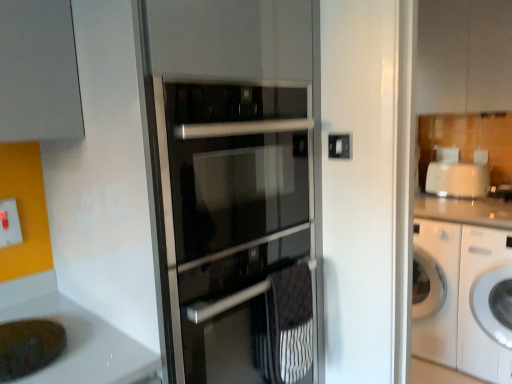
This screenshot has height=384, width=512. Describe the element at coordinates (9, 223) in the screenshot. I see `white plastic electric outlet at lower left` at that location.

What do you see at coordinates (485, 304) in the screenshot?
I see `white glossy washing machine at right` at bounding box center [485, 304].

What do you see at coordinates (464, 56) in the screenshot? This screenshot has height=384, width=512. I see `white glossy cabinet at upper center` at bounding box center [464, 56].

Locate an element on the screen. The width and height of the screenshot is (512, 384). matte white sink at lower left is located at coordinates pos(30,346).

Is white glossy cabinet at upper center oriented away from white plastic electric outlet at lower left?

No, white glossy cabinet at upper center's orientation is not away from white plastic electric outlet at lower left.

Can you confirm if white glossy cabinet at upper center is wider than white plastic electric outlet at lower left?

Yes.

Is white glossy cabinet at upper center far away from white plastic electric outlet at lower left?

Yes, white glossy cabinet at upper center and white plastic electric outlet at lower left are located far from each other.

Does black textured towel at center have a lesser width compared to white plastic electric outlet at lower left?

No.

In the scene shown: How much distance is there between black textured towel at center and white plastic electric outlet at lower left?

black textured towel at center is 36.09 inches from white plastic electric outlet at lower left.

Does black textured towel at center turn towards white plastic electric outlet at lower left?

No.

Is black textured towel at center positioned behind white plastic electric outlet at lower left?

No, black textured towel at center is closer to the viewer.

Which object is positioned more to the right, black textured towel at center or white glossy washing machine at right?

white glossy washing machine at right.

Is black textured towel at center positioned with its back to white glossy washing machine at right?

black textured towel at center is not turned away from white glossy washing machine at right.

Between black textured towel at center and white glossy washing machine at right, which one has smaller size?

Smaller between the two is black textured towel at center.

Measure the distance from black textured towel at center to white glossy washing machine at right.

A distance of 4.38 feet exists between black textured towel at center and white glossy washing machine at right.

From the image's perspective, which object appears higher, black textured towel at center or white glossy cabinet at upper center?

white glossy cabinet at upper center.

Is black textured towel at center closer to the viewer compared to white glossy cabinet at upper center?

Yes, the depth of black textured towel at center is less than that of white glossy cabinet at upper center.

From the picture: Would you say black textured towel at center is outside white glossy cabinet at upper center?

black textured towel at center is positioned outside white glossy cabinet at upper center.

From the picture: Considering the relative sizes of black textured towel at center and white glossy cabinet at upper center in the image provided, is black textured towel at center smaller than white glossy cabinet at upper center?

Yes.

Which object is positioned more to the right, white plastic electric outlet at lower left or white glossy washing machine at right?

From the viewer's perspective, white glossy washing machine at right appears more on the right side.

From the image's perspective, relative to white glossy washing machine at right, is white plastic electric outlet at lower left above or below?

From the image's perspective, white plastic electric outlet at lower left appears above white glossy washing machine at right.

Looking at their sizes, would you say white plastic electric outlet at lower left is wider or thinner than white glossy washing machine at right?

In the image, white plastic electric outlet at lower left appears to be more narrow than white glossy washing machine at right.

Between white plastic electric outlet at lower left and white glossy washing machine at right, which one is positioned behind?

white glossy washing machine at right is more distant.

Is white plastic electric outlet at lower left not near black textured towel at center?

No, white plastic electric outlet at lower left is in close proximity to black textured towel at center.

Is white plastic electric outlet at lower left situated inside black textured towel at center or outside?

white plastic electric outlet at lower left exists outside the volume of black textured towel at center.

Considering the relative sizes of white plastic electric outlet at lower left and black textured towel at center in the image provided, is white plastic electric outlet at lower left taller than black textured towel at center?

No.

Locate an element on the screen. The width and height of the screenshot is (512, 384). material lying in front of the white plastic electric outlet at lower left is located at coordinates (289, 324).

Does white glossy cabinet at upper center have a larger size compared to matte white sink at lower left?

Correct, white glossy cabinet at upper center is larger in size than matte white sink at lower left.

From the image's perspective, which one is positioned higher, white glossy cabinet at upper center or matte white sink at lower left?

white glossy cabinet at upper center is shown above in the image.

You are a GUI agent. You are given a task and a screenshot of the screen. Output one action in this format:
    pyautogui.click(x=<x>, y=<y>)
    Task: Click on the cabinetry that is above the matte white sink at lower left (from a real-world perspective)
    
    Given the screenshot: What is the action you would take?
    pyautogui.click(x=464, y=56)

Is point (452, 51) in front of point (9, 324)?

No, (452, 51) is further to viewer.

The image size is (512, 384). I want to click on cabinetry that appears above the white plastic electric outlet at lower left (from the image's perspective), so click(x=464, y=56).

This screenshot has width=512, height=384. I want to click on electric outlet located above the black textured towel at center (from a real-world perspective), so click(9, 223).

Which object lies further to the anchor point white plastic electric outlet at lower left, black textured towel at center or white glossy cabinet at upper center?

white glossy cabinet at upper center is further to white plastic electric outlet at lower left.

Estimate the real-world distances between objects in this image. Which object is closer to matte white sink at lower left, black textured towel at center or white plastic electric outlet at lower left?

white plastic electric outlet at lower left lies closer to matte white sink at lower left than the other object.

Estimate the real-world distances between objects in this image. Which object is closer to white plastic electric outlet at lower left, matte white sink at lower left or white glossy cabinet at upper center?

Based on the image, matte white sink at lower left appears to be nearer to white plastic electric outlet at lower left.

When comparing their distances from white glossy washing machine at right, does matte white sink at lower left or white plastic electric outlet at lower left seem closer?

Among the two, matte white sink at lower left is located nearer to white glossy washing machine at right.

Looking at the image, which one is located closer to white glossy cabinet at upper center, matte white sink at lower left or white glossy washing machine at right?

The object closer to white glossy cabinet at upper center is white glossy washing machine at right.

Which object lies further to the anchor point black textured towel at center, white glossy cabinet at upper center or matte white sink at lower left?

white glossy cabinet at upper center lies further to black textured towel at center than the other object.

Which object lies further to the anchor point matte white sink at lower left, white glossy washing machine at right or white glossy cabinet at upper center?

white glossy cabinet at upper center.

From the image, which object appears to be nearer to white glossy washing machine at right, white plastic electric outlet at lower left or white glossy cabinet at upper center?

white glossy cabinet at upper center is closer to white glossy washing machine at right.

At what (x,y) coordinates should I click in order to perform the action: click on material located between white plastic electric outlet at lower left and white glossy washing machine at right in the left-right direction. Please return your answer as a coordinate pair (x, y). Looking at the image, I should click on (289, 324).

You are a GUI agent. You are given a task and a screenshot of the screen. Output one action in this format:
    pyautogui.click(x=<x>, y=<y>)
    Task: Click on the material situated between white plastic electric outlet at lower left and white glossy cabinet at upper center from left to right
    This screenshot has height=384, width=512.
    Given the screenshot: What is the action you would take?
    pyautogui.click(x=289, y=324)

Locate an element on the screen. The image size is (512, 384). sink between white plastic electric outlet at lower left and white glossy washing machine at right from left to right is located at coordinates (30, 346).

This screenshot has width=512, height=384. What are the coordinates of `cabinetry between matte white sink at lower left and white glossy washing machine at right in the horizontal direction` in the screenshot? It's located at (464, 56).